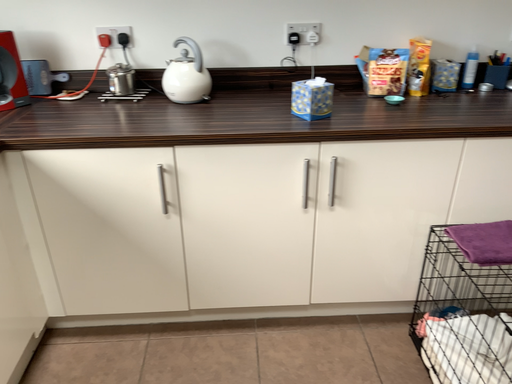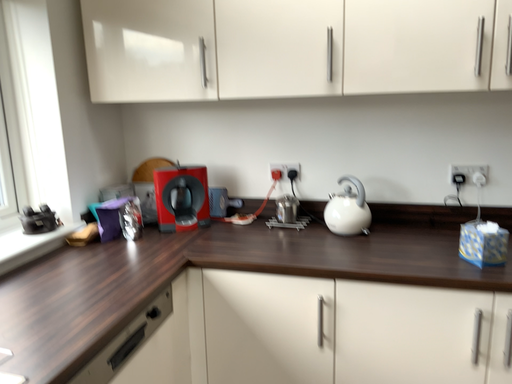
Question: How did the camera likely rotate when shooting the video?

Choices:
 (A) rotated upward
 (B) rotated downward

Answer: (A)